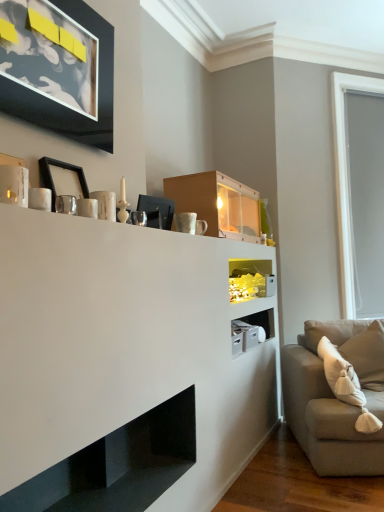
Question: Does beige soft cushion at right have a lesser width compared to gray matte window screen at right?

Choices:
 (A) no
 (B) yes

Answer: (A)

Question: Considering the relative positions of beige soft cushion at right and gray matte window screen at right in the image provided, is beige soft cushion at right behind gray matte window screen at right?

Choices:
 (A) no
 (B) yes

Answer: (A)

Question: Would you consider beige soft cushion at right to be distant from gray matte window screen at right?

Choices:
 (A) no
 (B) yes

Answer: (A)

Question: Considering the relative sizes of beige soft cushion at right and gray matte window screen at right in the image provided, is beige soft cushion at right smaller than gray matte window screen at right?

Choices:
 (A) no
 (B) yes

Answer: (B)

Question: From a real-world perspective, is beige soft cushion at right under gray matte window screen at right?

Choices:
 (A) no
 (B) yes

Answer: (B)

Question: Based on their positions, is beige soft cushion at right located to the left or right of black matte picture frame at upper left, the second picture frame positioned from the top?

Choices:
 (A) right
 (B) left

Answer: (A)

Question: Is beige soft cushion at right bigger or smaller than black matte picture frame at upper left, the second picture frame positioned from the top?

Choices:
 (A) small
 (B) big

Answer: (B)

Question: Is beige soft cushion at right inside the boundaries of black matte picture frame at upper left, the 1th picture frame from the bottom, or outside?

Choices:
 (A) outside
 (B) inside

Answer: (A)

Question: From a real-world perspective, is beige soft cushion at right above or below black matte picture frame at upper left, the second picture frame positioned from the top?

Choices:
 (A) above
 (B) below

Answer: (B)

Question: Choose the correct answer: Is black glossy shelf at lower center, which appears as the 2th shelf when viewed from the top, inside translucent glass shelf at center, positioned as the 1th shelf in back-to-front order, or outside it?

Choices:
 (A) outside
 (B) inside

Answer: (A)

Question: Looking at their shapes, would you say black glossy shelf at lower center, arranged as the second shelf when viewed from the back, is wider or thinner than translucent glass shelf at center, positioned as the 1th shelf in back-to-front order?

Choices:
 (A) thin
 (B) wide

Answer: (B)

Question: Is black glossy shelf at lower center, the first shelf from the front, in front of or behind translucent glass shelf at center, which appears as the 1th shelf when viewed from the top, in the image?

Choices:
 (A) behind
 (B) front

Answer: (B)

Question: From a real-world perspective, relative to translucent glass shelf at center, positioned as the 1th shelf in back-to-front order, is black glossy shelf at lower center, the first shelf when ordered from left to right, vertically above or below?

Choices:
 (A) below
 (B) above

Answer: (A)

Question: Considering the positions of point click(x=297, y=418) and point click(x=233, y=207), is point click(x=297, y=418) closer or farther from the camera than point click(x=233, y=207)?

Choices:
 (A) farther
 (B) closer

Answer: (B)

Question: Considering the positions of light gray fabric couch at right and matte wood cabinet at upper center in the image, is light gray fabric couch at right bigger or smaller than matte wood cabinet at upper center?

Choices:
 (A) small
 (B) big

Answer: (B)